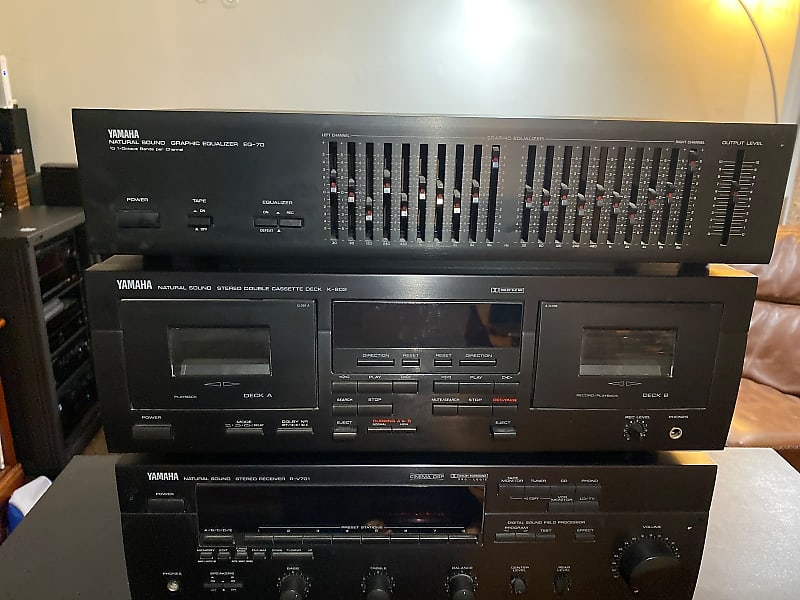
Where is `stereo system`? The width and height of the screenshot is (800, 600). stereo system is located at coordinates (202, 177), (176, 354), (165, 549).